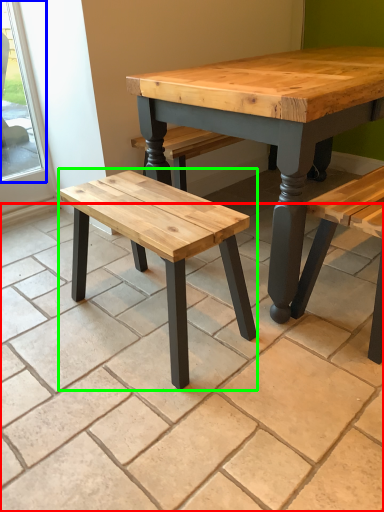
Question: Which is farther away from tile (highlighted by a red box)? window (highlighted by a blue box) or stool (highlighted by a green box)?

Choices:
 (A) window
 (B) stool

Answer: (A)